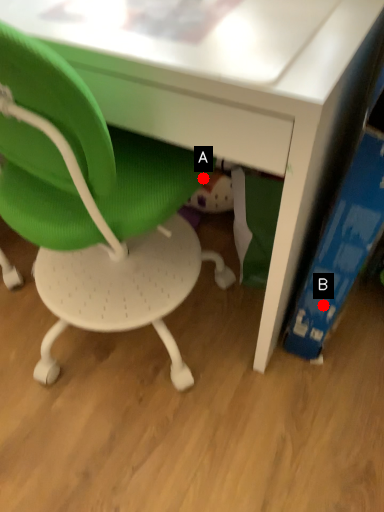
Question: Two points are circled on the image, labeled by A and B beside each circle. Which point is closer to the camera?

Choices:
 (A) A is closer
 (B) B is closer

Answer: (A)